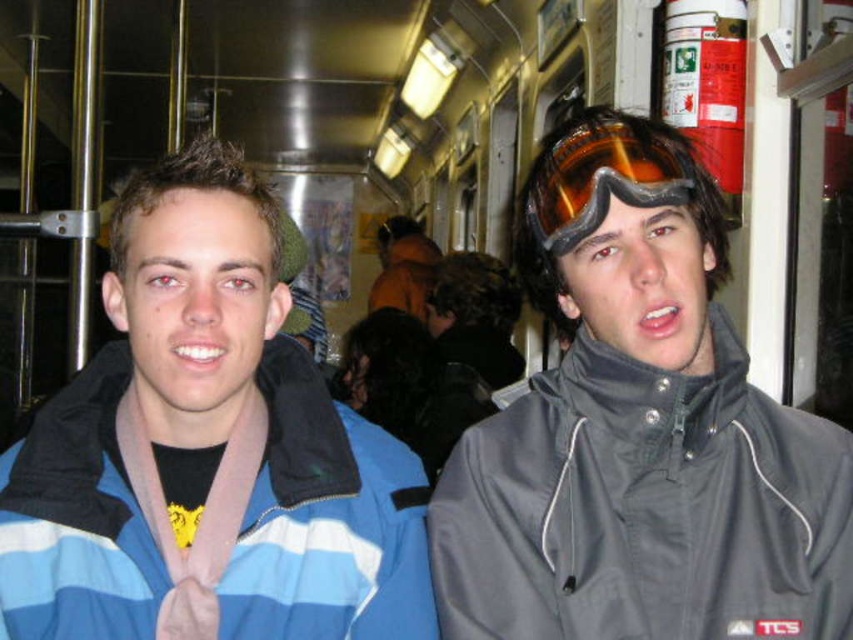
From the picture: Is blue striped jacket at center above orange reflective lens goggles at upper right?

No.

Between blue striped jacket at center and orange reflective lens goggles at upper right, which one has less height?

orange reflective lens goggles at upper right

This screenshot has height=640, width=853. Describe the element at coordinates (206, 451) in the screenshot. I see `blue striped jacket at center` at that location.

Identify the location of blue striped jacket at center. This screenshot has width=853, height=640. (206, 451).

At what (x,y) coordinates should I click in order to perform the action: click on gray matte jacket at center. Please return your answer as a coordinate pair (x, y). The image size is (853, 640). Looking at the image, I should click on (640, 438).

Which of these two, gray matte jacket at center or orange reflective lens goggles at upper right, stands taller?

With more height is gray matte jacket at center.

The width and height of the screenshot is (853, 640). In order to click on gray matte jacket at center in this screenshot , I will do `click(640, 438)`.

In order to click on gray matte jacket at center in this screenshot , I will do `click(640, 438)`.

Between gray matte jacket at center and blue striped jacket at center, which one has less height?

With less height is gray matte jacket at center.

From the picture: Who is higher up, gray matte jacket at center or blue striped jacket at center?

gray matte jacket at center is higher up.

Between point (639, 497) and point (219, 234), which one is positioned in front?

Positioned in front is point (219, 234).

This screenshot has height=640, width=853. Identify the location of gray matte jacket at center. (640, 438).